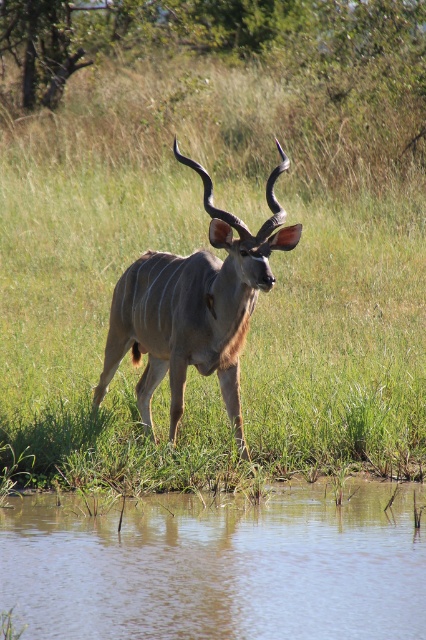
Can you confirm if green grass at center is positioned below brown muddy water at lower center?

No, green grass at center is not below brown muddy water at lower center.

Where is `green grass at center`? The image size is (426, 640). green grass at center is located at coordinates (207, 246).

Is green grass at center positioned in front of brown textured antelope at center?

No, green grass at center is further to the viewer.

Who is higher up, green grass at center or brown textured antelope at center?

Positioned higher is green grass at center.

Where is `green grass at center`? The image size is (426, 640). green grass at center is located at coordinates (207, 246).

Can you confirm if brown muddy water at lower center is positioned to the right of brown textured antelope at center?

Indeed, brown muddy water at lower center is positioned on the right side of brown textured antelope at center.

Is brown muddy water at lower center smaller than brown textured antelope at center?

Yes.

Who is more forward, (x=85, y=576) or (x=282, y=216)?

Point (x=85, y=576) is in front.

This screenshot has height=640, width=426. What are the coordinates of `brown muddy water at lower center` in the screenshot? It's located at coord(218,566).